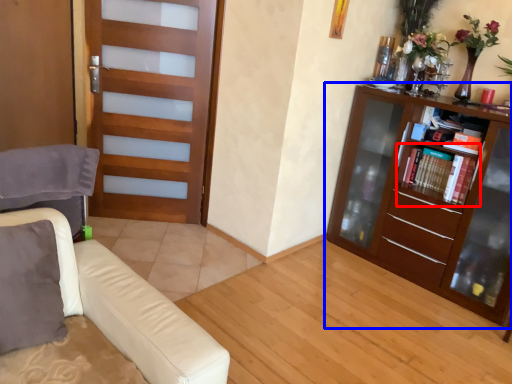
Question: Which of the following is the closest to the observer, shelf (highlighted by a red box) or bookcase (highlighted by a blue box)?

Choices:
 (A) shelf
 (B) bookcase

Answer: (B)